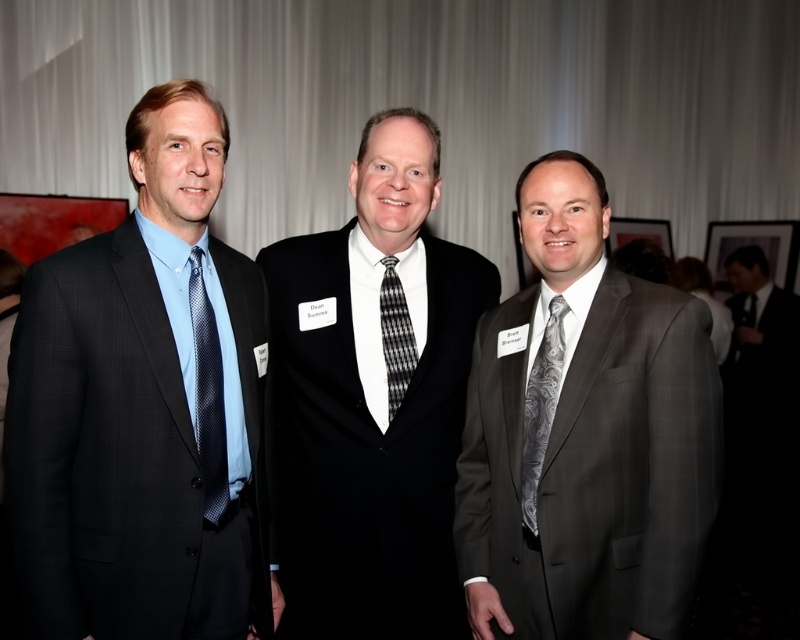
You are organizing a photo shoot and need to ensure that the gray textured suit at center and the black wool suit at center are spaced exactly 12 inches apart. Based on the current positioning in the image, do you need to move them closer together or farther apart to meet this requirement?

The gray textured suit at center is currently 12.62 inches away from the black wool suit at center. To achieve the desired 12 inches, you need to move them closer together by 0.62 inches.

Please provide the coordinates of the gray textured suit at center in the image. The coordinate system is based on the top left corner of the image being the origin point. The x and y values should be between 0 and 1. The answer should be in the format of a tuple with two decimal places, like this example format for coordinates at 0.5,0.5 would be written as 0.50,0.50. Please make sure to include the parentheses and the comma between the numbers. The answer should be concise and only include the coordinates

The coordinates of the gray textured suit at center are at point (584, 435).

You are organizing a photo shoot and need to arrange the models in a straight line from left to right based on their clothing. Given the current arrangement of the matte black suit at left and the black textured tie at center, which item is positioned further to the left?

The matte black suit at left is positioned further to the left compared to the black textured tie at center.